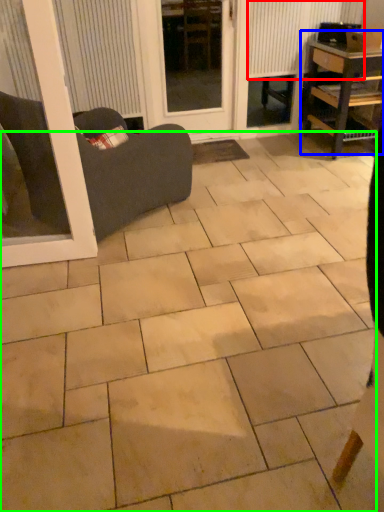
Question: Considering the real-world distances, which object is farthest from radiator (highlighted by a red box)? table (highlighted by a blue box) or ceramic tile (highlighted by a green box)?

Choices:
 (A) table
 (B) ceramic tile

Answer: (B)